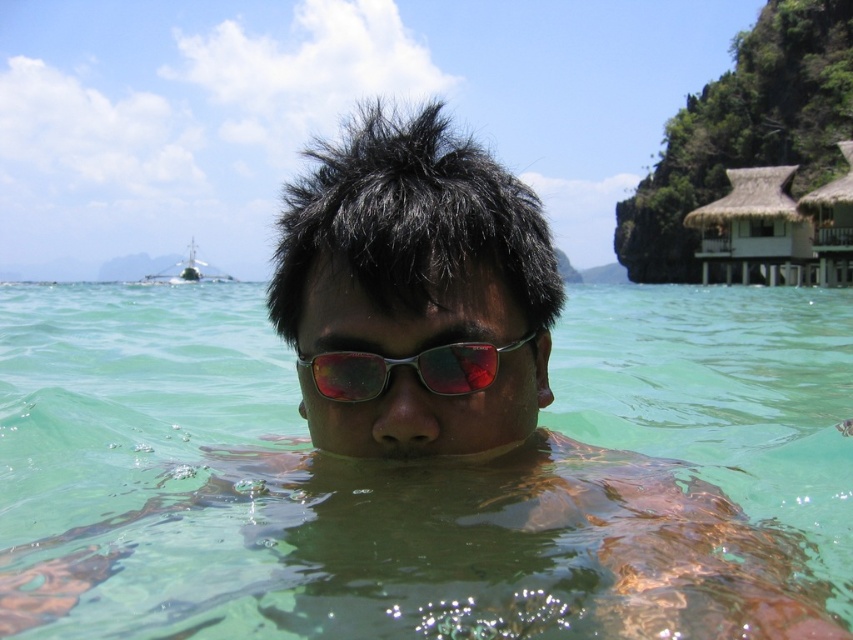
Question: Does white thatch hut at upper right appear on the right side of shiny metallic sunglasses at center?

Choices:
 (A) no
 (B) yes

Answer: (B)

Question: Which of the following is the closest to the observer?

Choices:
 (A) (532, 337)
 (B) (730, 170)

Answer: (A)

Question: Can you confirm if white thatch hut at upper right is positioned to the right of shiny metallic sunglasses at center?

Choices:
 (A) no
 (B) yes

Answer: (B)

Question: Can you confirm if white thatch hut at upper right is positioned below shiny metallic sunglasses at center?

Choices:
 (A) yes
 (B) no

Answer: (B)